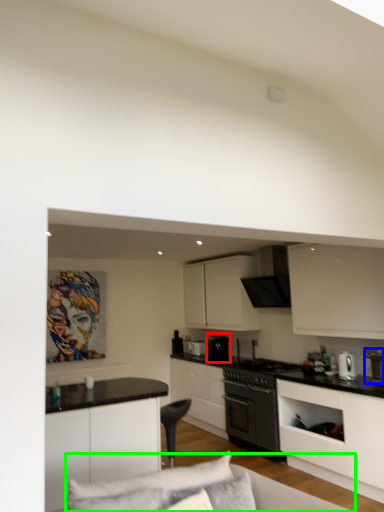
Question: Which object is positioned closest to appliance (highlighted by a red box)? Select from appliance (highlighted by a blue box) and couch (highlighted by a green box).

Choices:
 (A) appliance
 (B) couch

Answer: (A)